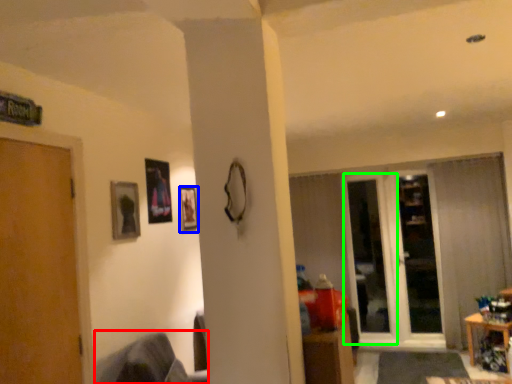
Question: Which object is positioned farthest from swivel chair (highlighted by a red box)? Select from picture frame (highlighted by a blue box) and screen door (highlighted by a green box).

Choices:
 (A) picture frame
 (B) screen door

Answer: (B)